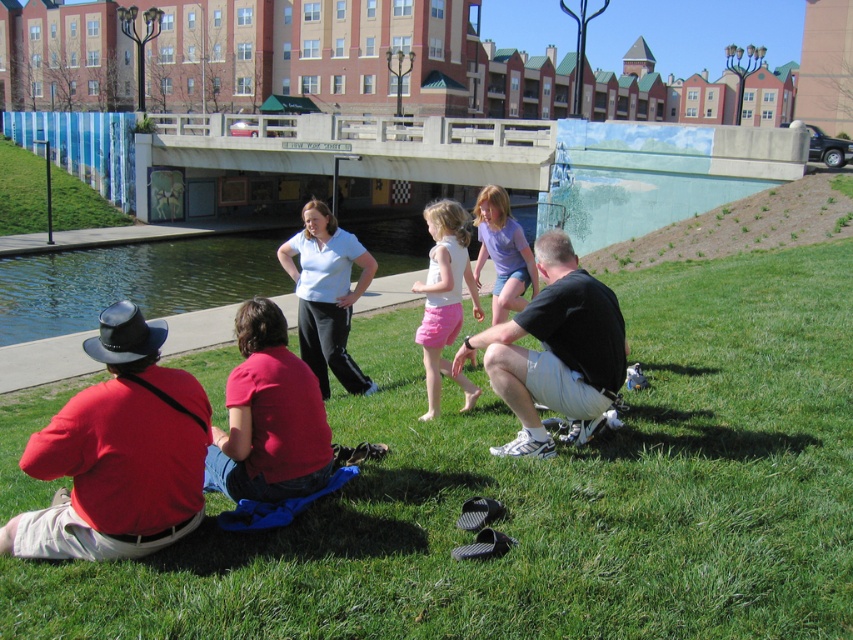
In the scene shown: You are trying to decide which shirt to take for a picnic. The black cotton shirt at lower right and the matte white shirt at center are both available. Which one is wider?

The black cotton shirt at lower right is wider than the matte white shirt at center.

You are standing at the edge of the grassy area and want to pick up both the black cotton shirt at lower right and the matte white shirt at center. Which shirt should you pick up first to follow the leftmost path?

You should pick up the matte white shirt at center first because it is positioned to the left of the black cotton shirt at lower right, so following the leftmost path would require retrieving it first.

Consider the image. You are a photographer trying to capture a photo of the red cotton shirt at lower left and the matte white tank top at center. Which object should you focus on first if you want to ensure both are in sharp focus?

The red cotton shirt at lower left is positioned under the matte white tank top at center, so focusing on the matte white tank top at center first would help ensure both are in focus as it is closer to the camera.